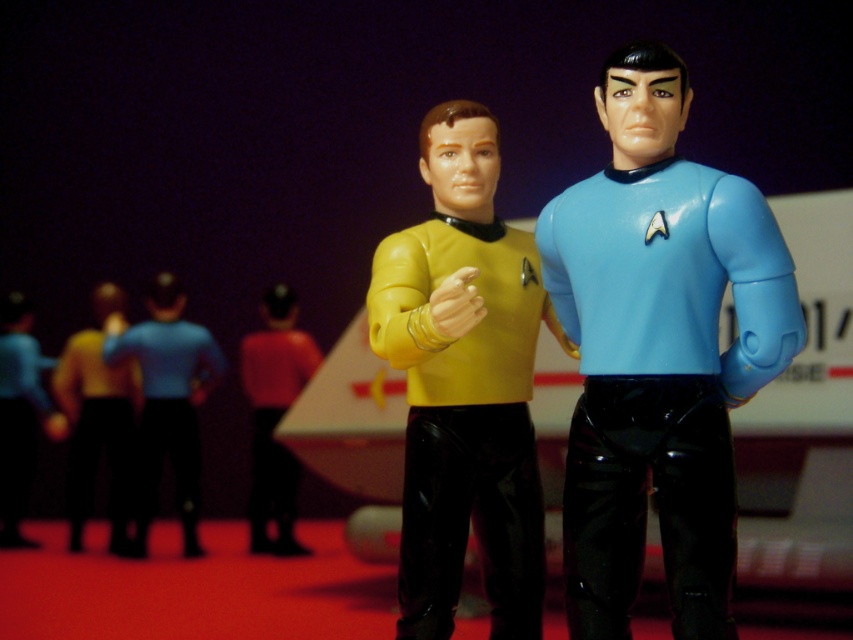
You are a Star Trek fan looking at the two figurines. The blue glossy uniform at center is represented by point (x=659, y=352). Which figurine has the point on its uniform?

The blue glossy uniform at center is represented by point (x=659, y=352), so the figurine with the blue shirt has the point on its uniform.